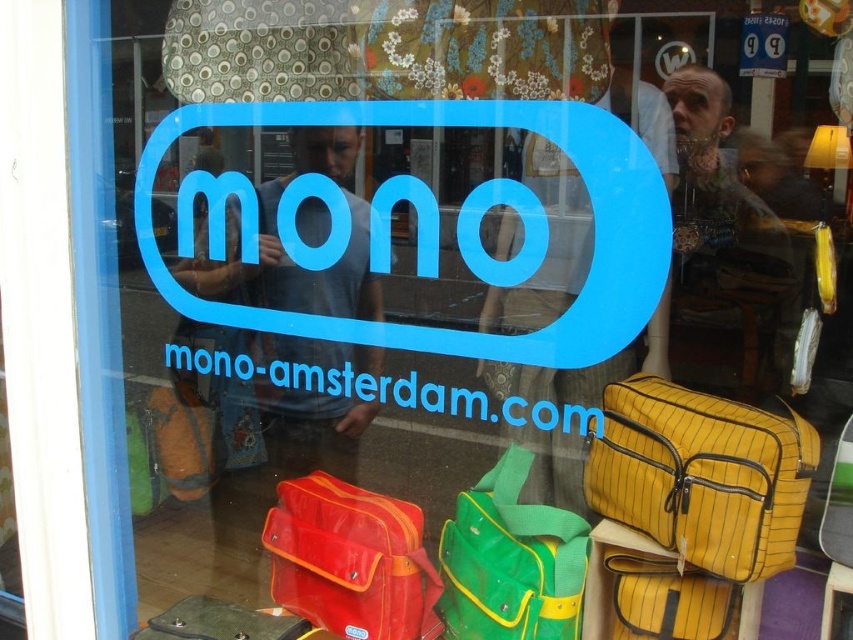
In the scene shown: You are standing outside the store looking at the mono storefront window display. You see a yellow striped fabric bag at lower right. Where exactly is the yellow striped fabric bag located in the window display?

The yellow striped fabric bag at lower right is located at the 2D coordinates point of (701, 476) in the window display.

You are standing outside the store looking at the window display. There are two points marked on the glass at coordinates point (x=483, y=595) and point (x=264, y=620). Which point is closer to you?

Point (x=483, y=595) is closer to the viewer than point (x=264, y=620).

You are standing outside the store looking at the mono storefront window display. The store has a large blue logo and website displayed. There is a matte red bag at center. Where is the matte red bag located in the window display?

The matte red bag at center is located at the 2D coordinates point (350, 561) in the window display.